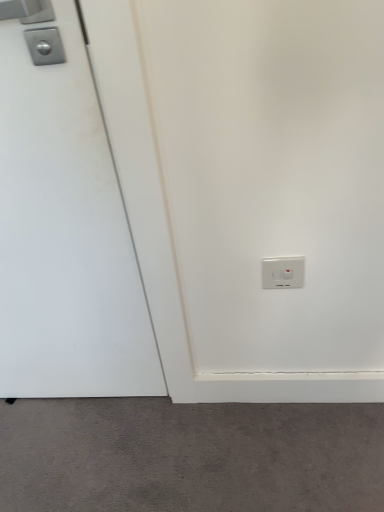
Question: Considering the relative sizes of white matte door at left and gray matte carpet at lower center in the image provided, is white matte door at left taller than gray matte carpet at lower center?

Choices:
 (A) no
 (B) yes

Answer: (B)

Question: Could you tell me if white matte door at left is facing gray matte carpet at lower center?

Choices:
 (A) yes
 (B) no

Answer: (B)

Question: Is white matte door at left positioned with its back to gray matte carpet at lower center?

Choices:
 (A) no
 (B) yes

Answer: (A)

Question: Does white matte door at left have a smaller size compared to gray matte carpet at lower center?

Choices:
 (A) yes
 (B) no

Answer: (B)

Question: Does white matte door at left appear on the right side of gray matte carpet at lower center?

Choices:
 (A) yes
 (B) no

Answer: (B)

Question: Is point (284, 279) closer or farther from the camera than point (312, 496)?

Choices:
 (A) closer
 (B) farther

Answer: (A)

Question: Looking at their shapes, would you say white plastic power plugs and sockets at lower right is wider or thinner than gray matte carpet at lower center?

Choices:
 (A) thin
 (B) wide

Answer: (A)

Question: In the image, is white plastic power plugs and sockets at lower right on the left side or the right side of gray matte carpet at lower center?

Choices:
 (A) right
 (B) left

Answer: (A)

Question: Looking at the image, does white plastic power plugs and sockets at lower right seem bigger or smaller compared to gray matte carpet at lower center?

Choices:
 (A) small
 (B) big

Answer: (A)

Question: Relative to white plastic power plugs and sockets at lower right, is gray matte carpet at lower center in front or behind?

Choices:
 (A) behind
 (B) front

Answer: (A)

Question: In terms of height, does gray matte carpet at lower center look taller or shorter compared to white plastic power plugs and sockets at lower right?

Choices:
 (A) tall
 (B) short

Answer: (B)

Question: Is gray matte carpet at lower center wider or thinner than white plastic power plugs and sockets at lower right?

Choices:
 (A) wide
 (B) thin

Answer: (A)

Question: Looking at the image, does gray matte carpet at lower center seem bigger or smaller compared to white plastic power plugs and sockets at lower right?

Choices:
 (A) big
 (B) small

Answer: (A)

Question: Is white matte door at left inside the boundaries of gray matte carpet at lower center, or outside?

Choices:
 (A) inside
 (B) outside

Answer: (B)

Question: In the image, is white matte door at left positioned in front of or behind gray matte carpet at lower center?

Choices:
 (A) behind
 (B) front

Answer: (B)